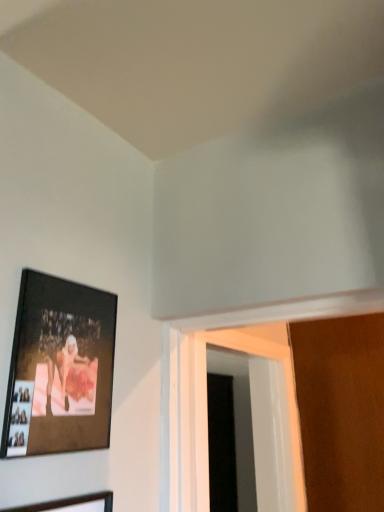
Question: In terms of width, does wooden picture frame at lower left, the second picture frame from the top, look wider or thinner when compared to white plastic door at lower right?

Choices:
 (A) thin
 (B) wide

Answer: (A)

Question: From a real-world perspective, is wooden picture frame at lower left, the second picture frame from the top, physically located above or below white plastic door at lower right?

Choices:
 (A) above
 (B) below

Answer: (B)

Question: Estimate the real-world distances between objects in this image. Which object is closer to the matte black picture frame at upper left, the first picture frame viewed from the top?

Choices:
 (A) wooden picture frame at lower left, the second picture frame from the top
 (B) white plastic door at lower right

Answer: (A)

Question: Which of these objects is positioned farthest from the matte black picture frame at upper left, the first picture frame viewed from the top?

Choices:
 (A) wooden picture frame at lower left, the second picture frame from the top
 (B) white plastic door at lower right

Answer: (B)